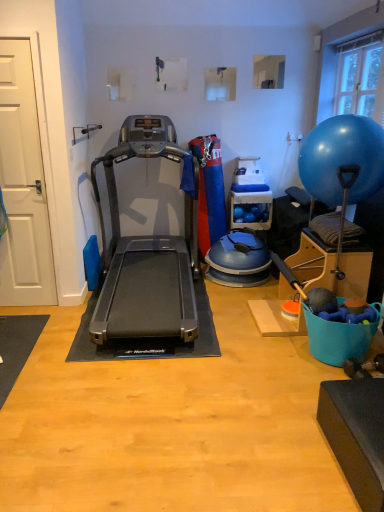
Locate an element on the screen. This screenshot has height=512, width=384. free spot in front of white matte door at left is located at coordinates (29, 312).